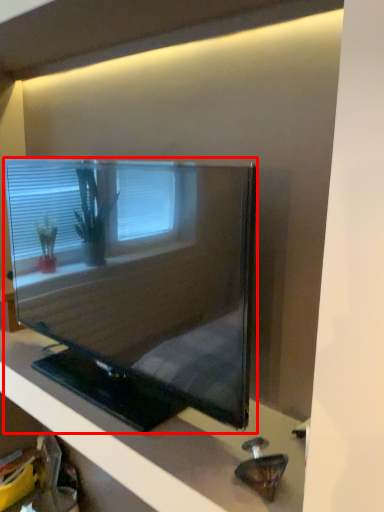
Question: From the image, what is the correct spatial relationship of television (annotated by the red box) in relation to furniture?

Choices:
 (A) right
 (B) left

Answer: (A)